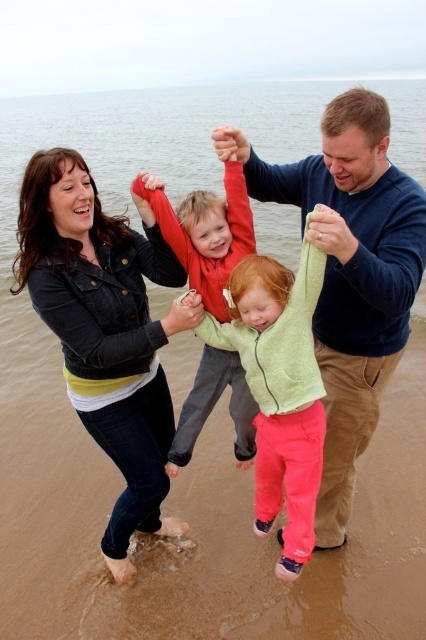
You are standing at the beach looking at the family. There are two points marked in the image. Which point is closer to you, point (357, 595) or point (137, 358)?

Point (137, 358) is closer to you because the Objects Description states that point (357, 595) is further away than point (137, 358).

You are a photographer trying to capture the family photo. You notice the blue sweater at upper center and the light green fleece jacket at center. Which clothing item is closer to the camera?

The blue sweater at upper center is closer to the camera because it is in front of the light green fleece jacket at center.